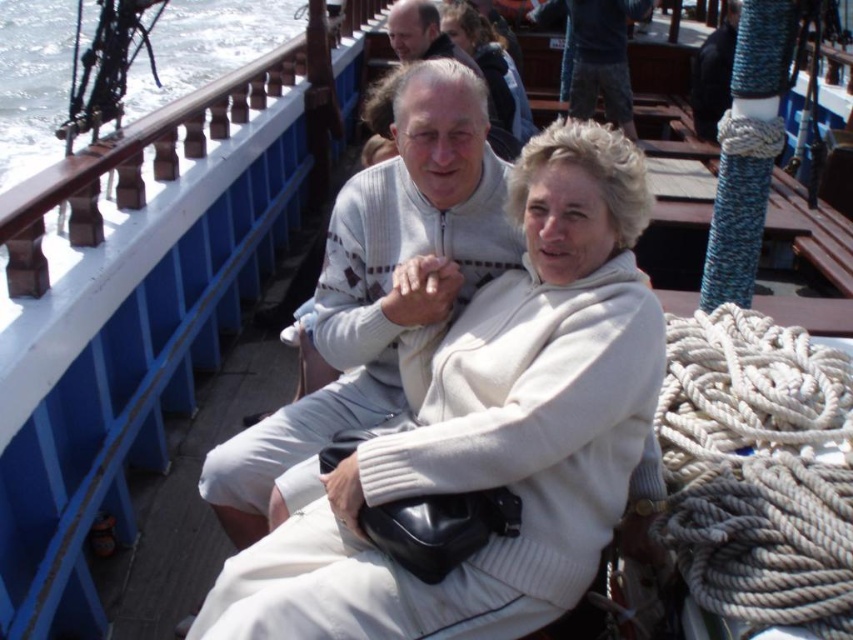
Between dark blue jeans at upper center and white wool sweater at upper center, which one has more height?

Standing taller between the two is dark blue jeans at upper center.

Is dark blue jeans at upper center above white wool sweater at upper center?

Indeed, dark blue jeans at upper center is positioned over white wool sweater at upper center.

Image resolution: width=853 pixels, height=640 pixels. In order to click on dark blue jeans at upper center in this screenshot , I will do `click(602, 58)`.

Where is `dark blue jeans at upper center`? dark blue jeans at upper center is located at coordinates (602, 58).

Where is `dark blue jeans at upper center`? dark blue jeans at upper center is located at coordinates (602, 58).

Locate an element on the screen. The image size is (853, 640). dark blue jeans at upper center is located at coordinates (602, 58).

Image resolution: width=853 pixels, height=640 pixels. I want to click on dark blue jeans at upper center, so click(602, 58).

Between point (373, 234) and point (611, 56), which one is positioned in front?

Point (373, 234) is more forward.

Who is higher up, light gray sweater at center or dark blue jeans at upper center?

Positioned higher is dark blue jeans at upper center.

Identify the location of light gray sweater at center. (376, 285).